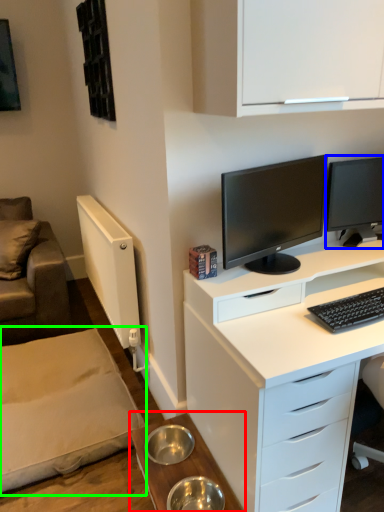
Question: Estimate the real-world distances between objects in this image. Which object is closer to table (highlighted by a red box), computer monitor (highlighted by a blue box) or plain (highlighted by a green box)?

Choices:
 (A) computer monitor
 (B) plain

Answer: (B)